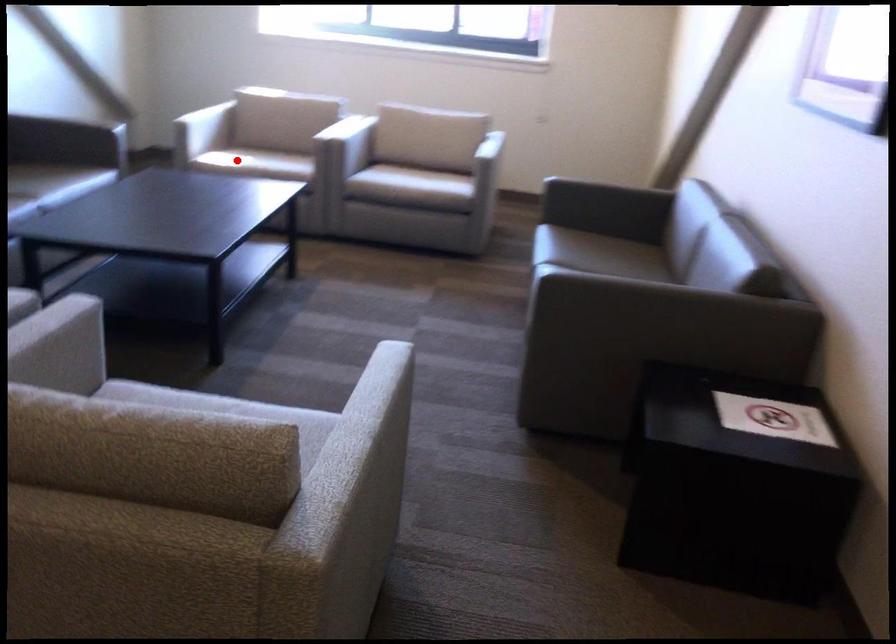
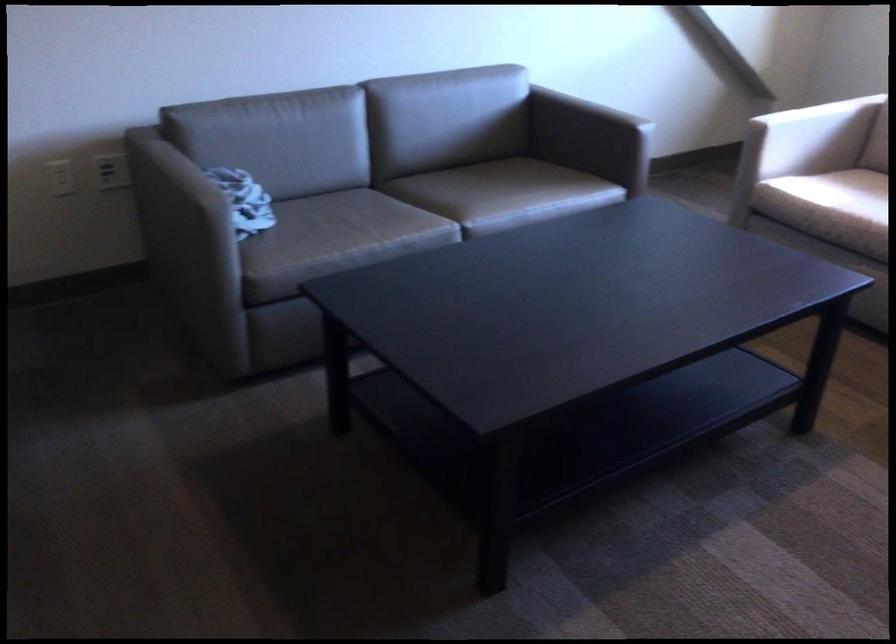
Locate, in the second image, the point that corresponds to the highlighted location in the first image.

(821, 216)